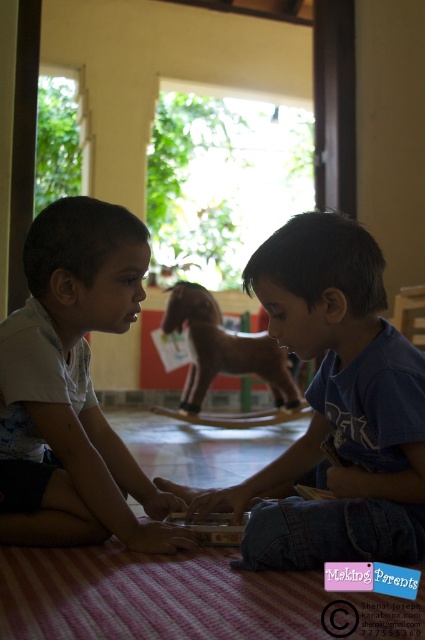
Who is higher up, blue cotton shirt at center or white matte shirt at left?

Positioned higher is white matte shirt at left.

Is blue cotton shirt at center shorter than white matte shirt at left?

Yes, blue cotton shirt at center is shorter than white matte shirt at left.

Between point (266, 512) and point (22, 532), which one is positioned behind?

The point (22, 532) is behind.

At what (x,y) coordinates should I click in order to perform the action: click on blue cotton shirt at center. Please return your answer as a coordinate pair (x, y). Image resolution: width=425 pixels, height=640 pixels. Looking at the image, I should click on (334, 410).

Does blue cotton shirt at center come behind wooden horse at center?

No.

Between blue cotton shirt at center and wooden horse at center, which one appears on the left side from the viewer's perspective?

Positioned to the left is wooden horse at center.

The height and width of the screenshot is (640, 425). Describe the element at coordinates (334, 410) in the screenshot. I see `blue cotton shirt at center` at that location.

Where is `blue cotton shirt at center`? This screenshot has width=425, height=640. blue cotton shirt at center is located at coordinates (334, 410).

Who is shorter, white matte shirt at left or wooden horse at center?

Standing shorter between the two is white matte shirt at left.

Locate an element on the screen. white matte shirt at left is located at coordinates (78, 380).